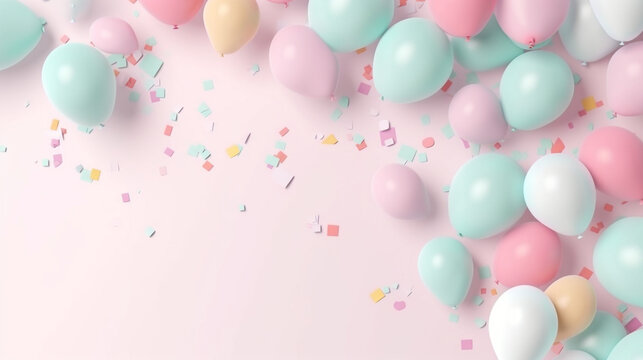
Image resolution: width=643 pixels, height=360 pixels. Find the location of `visible yellow balloons and pieces of confetti`. visible yellow balloons and pieces of confetti is located at coordinates click(379, 294), click(330, 141), click(233, 154), click(96, 173), click(53, 125), click(231, 29), click(575, 300), click(586, 105).